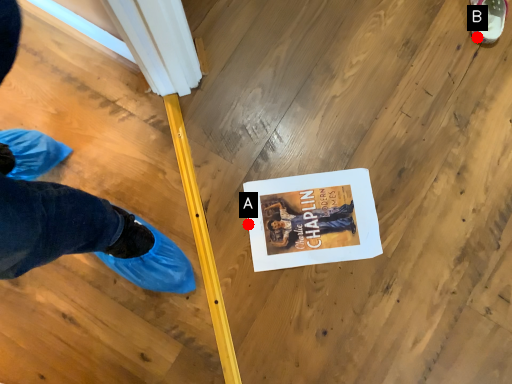
Question: Two points are circled on the image, labeled by A and B beside each circle. Which of the following is the farthest from the observer?

Choices:
 (A) A is further
 (B) B is further

Answer: (B)